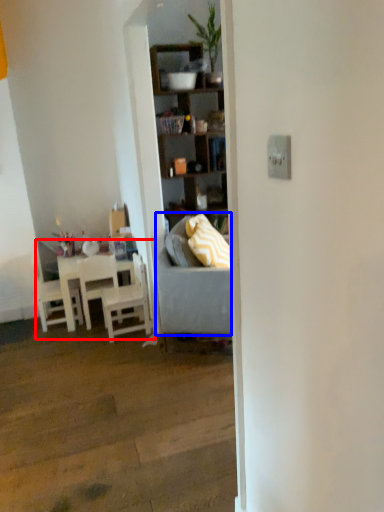
Question: Which object is closer to the camera taking this photo, kitchen & dining room table (highlighted by a red box) or studio couch (highlighted by a blue box)?

Choices:
 (A) kitchen & dining room table
 (B) studio couch

Answer: (B)